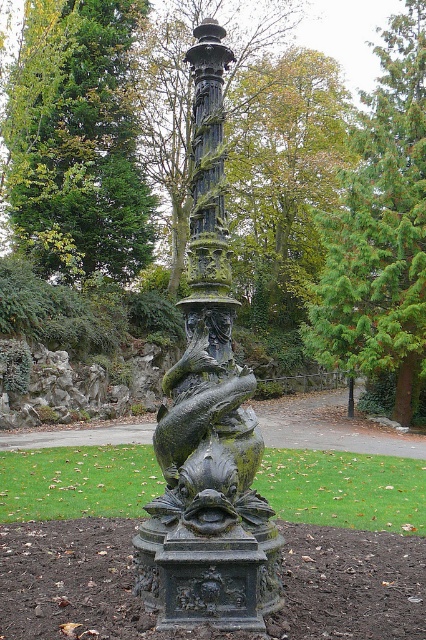
You are standing in front of the ornate column in the park. There are two points marked on the column. The first point is at coordinates point (192, 586) and the second point is at point (203, 216). Which of these two points is nearer to your current position?

Point (192, 586) is closer to the camera than point (203, 216), so the first point is nearer to your current position.

Based on the scene description, can you determine which object, the green textured tree at upper center or the bronze textured column at center, has a larger width?

The green textured tree at upper center might be wider than bronze textured column at center according to the description.